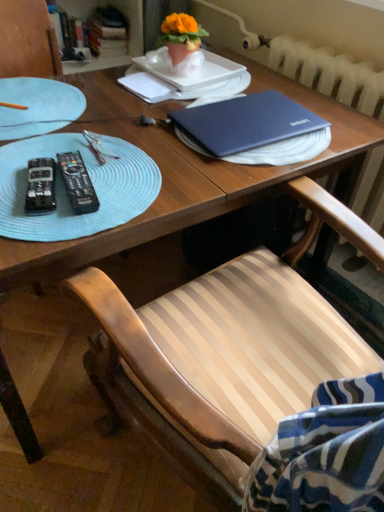
The height and width of the screenshot is (512, 384). I want to click on vacant space situated on the left part of white paper at upper center, so click(x=91, y=93).